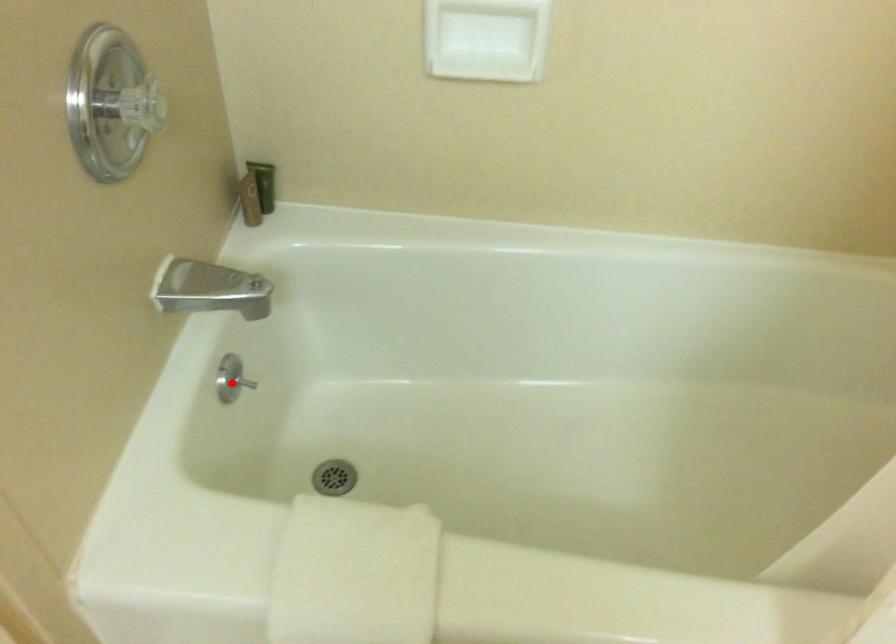
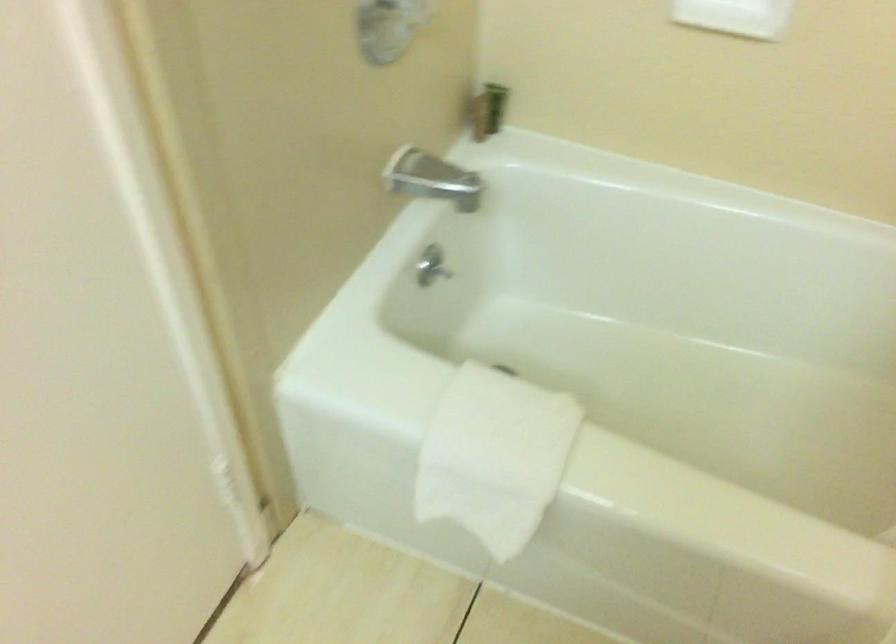
Where in the second image is the point corresponding to the highlighted location from the first image?

(431, 266)